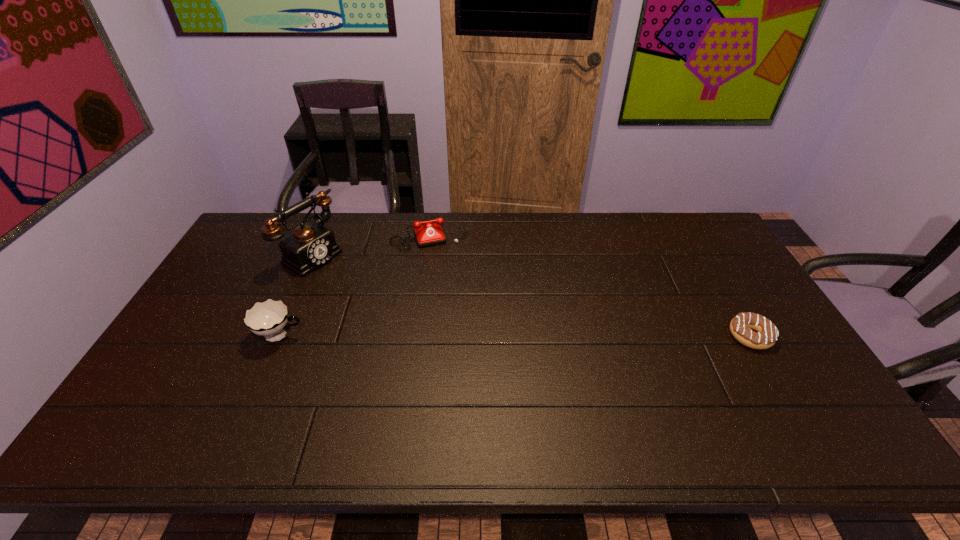
Identify the location of vacant spot on the desktop that is between the cup and the shortest object and is positioned on the dial of the right telephone. This screenshot has height=540, width=960. (465, 336).

Where is `vacant space on the desktop that is between the cup and the doughnut and is positioned on the front of the taller telephone at the rotary dial`? The image size is (960, 540). vacant space on the desktop that is between the cup and the doughnut and is positioned on the front of the taller telephone at the rotary dial is located at coordinates (457, 336).